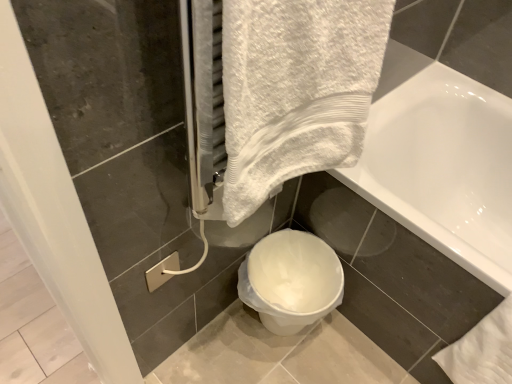
Question: Considering the relative positions of white plastic toilet at lower center and white glossy bathtub at upper right in the image provided, is white plastic toilet at lower center to the left or to the right of white glossy bathtub at upper right?

Choices:
 (A) right
 (B) left

Answer: (B)

Question: Does point (324, 253) appear closer or farther from the camera than point (499, 291)?

Choices:
 (A) farther
 (B) closer

Answer: (A)

Question: Considering their positions, is white plastic toilet at lower center located in front of or behind white glossy bathtub at upper right?

Choices:
 (A) front
 (B) behind

Answer: (B)

Question: From the image's perspective, is white glossy bathtub at upper right located above or below white plastic toilet at lower center?

Choices:
 (A) above
 (B) below

Answer: (A)

Question: From a real-world perspective, is white glossy bathtub at upper right physically located above or below white plastic toilet at lower center?

Choices:
 (A) below
 (B) above

Answer: (B)

Question: Is white glossy bathtub at upper right to the left or to the right of white plastic toilet at lower center in the image?

Choices:
 (A) left
 (B) right

Answer: (B)

Question: Considering the positions of white glossy bathtub at upper right and white plastic toilet at lower center in the image, is white glossy bathtub at upper right taller or shorter than white plastic toilet at lower center?

Choices:
 (A) tall
 (B) short

Answer: (A)